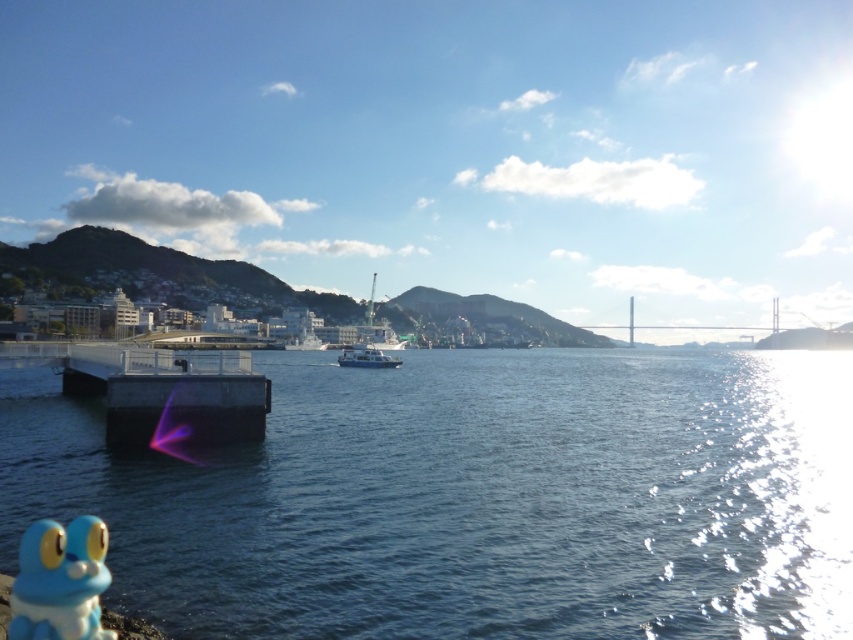
Question: Is smooth concrete dock at center-left positioned at the back of metallic gray bridge at center right?

Choices:
 (A) yes
 (B) no

Answer: (B)

Question: Which object appears farthest from the camera in this image?

Choices:
 (A) white matte boat at center
 (B) metallic gray bridge at center right

Answer: (B)

Question: In this image, where is smooth concrete dock at center-left located relative to metallic gray bridge at center right?

Choices:
 (A) above
 (B) below

Answer: (B)

Question: Among these objects, which one is farthest from the camera?

Choices:
 (A) white matte boat at center
 (B) smooth concrete dock at center-left
 (C) blue rubber frog at lower left
 (D) blue water at center

Answer: (A)

Question: Estimate the real-world distances between objects in this image. Which object is closer to the smooth concrete dock at center-left?

Choices:
 (A) metallic gray bridge at center right
 (B) blue rubber frog at lower left

Answer: (B)

Question: Is blue water at center above metallic gray bridge at center right?

Choices:
 (A) yes
 (B) no

Answer: (B)